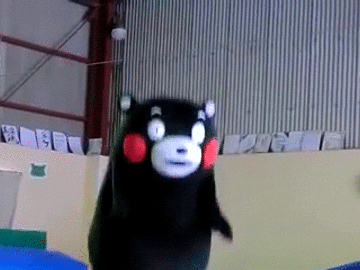
Image resolution: width=360 pixels, height=270 pixels. In order to click on teddy bears face in this screenshot , I will do `click(193, 72)`.